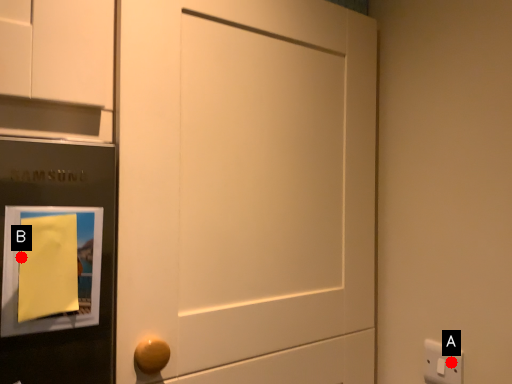
Question: Two points are circled on the image, labeled by A and B beside each circle. Which point is closer to the camera taking this photo?

Choices:
 (A) A is closer
 (B) B is closer

Answer: (B)